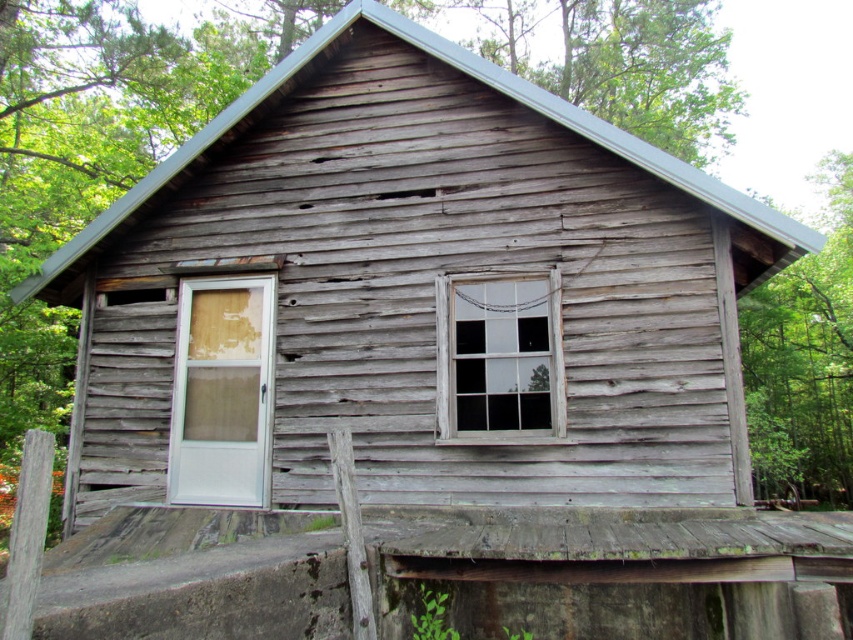
You are standing in front of the cabin and want to take a photo of the green leafy tree at upper right. Where should you position yourself to ensure the tree is centered in your camera view?

To center the green leafy tree at upper right in your camera view, position yourself so that the tree is aligned with the center point of your camera frame, which corresponds to coordinates approximately at the center of your viewfinder. Since the tree is located at point (804, 360) in the image, you should adjust your position to center it by moving slightly to the left and down to bring it to the center of your frame.

You are standing in front of the rustic wooden cabin and want to enter through the white plastic door at left. To avoid the clear glass window at center, which is in your way, should you move to your left or right?

The white plastic door at left is located below the clear glass window at center, so the window is above the door. Therefore, you don not need to move to either side to avoid it as it is positioned above the door.

Based on the photo, you are standing outside the cabin and looking at the green leafy tree at upper right and the clear glass window at center. Which object is positioned to the right of the other?

The green leafy tree at upper right is to the right of the clear glass window at center.